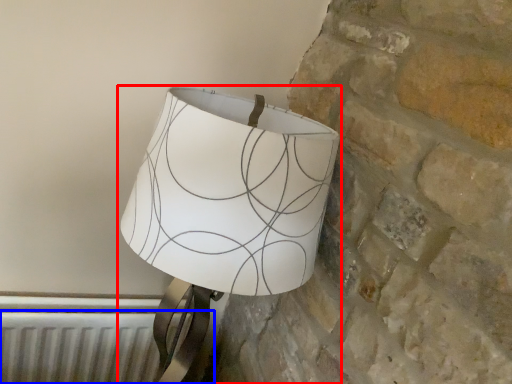
Question: Which object is further to the camera taking this photo, lamp (highlighted by a red box) or radiator (highlighted by a blue box)?

Choices:
 (A) lamp
 (B) radiator

Answer: (B)